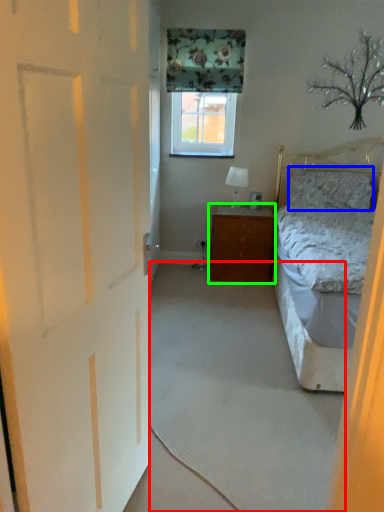
Question: Which is nearer to the plain (highlighted by a red box)? pillow (highlighted by a blue box) or cabinetry (highlighted by a green box).

Choices:
 (A) pillow
 (B) cabinetry

Answer: (B)